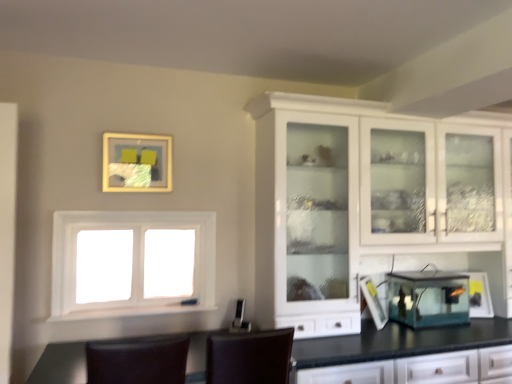
Question: Which direction should I rotate to look at transparent glass fish tank at center, which is counted as the 1th appliance, starting from the left?

Choices:
 (A) left
 (B) right

Answer: (B)

Question: Can you confirm if white glossy cabinet at upper right is taller than brown leather chair at lower center, the first chair from the left?

Choices:
 (A) yes
 (B) no

Answer: (A)

Question: Is white glossy cabinet at upper right to the right of brown leather chair at lower center, the 2th chair when ordered from right to left, from the viewer's perspective?

Choices:
 (A) yes
 (B) no

Answer: (A)

Question: From a real-world perspective, is white glossy cabinet at upper right positioned under brown leather chair at lower center, the 2th chair when ordered from right to left, based on gravity?

Choices:
 (A) no
 (B) yes

Answer: (A)

Question: Does white glossy cabinet at upper right have a larger size compared to brown leather chair at lower center, the 2th chair when ordered from right to left?

Choices:
 (A) yes
 (B) no

Answer: (A)

Question: Is white glossy cabinet at upper right not near brown leather chair at lower center, the 2th chair when ordered from right to left?

Choices:
 (A) yes
 (B) no

Answer: (A)

Question: From a real-world perspective, is white glossy cabinet at upper right on brown leather chair at lower center, the 2th chair when ordered from right to left?

Choices:
 (A) yes
 (B) no

Answer: (A)

Question: Can you confirm if transparent glass lantern at lower right, which ranks as the second appliance in left-to-right order, is thinner than transparent glass fish tank at center, which is counted as the 1th appliance, starting from the left?

Choices:
 (A) yes
 (B) no

Answer: (A)

Question: From a real-world perspective, is transparent glass lantern at lower right, the first appliance in the right-to-left sequence, positioned over transparent glass fish tank at center, which is the second appliance in right-to-left order, based on gravity?

Choices:
 (A) no
 (B) yes

Answer: (A)

Question: Is transparent glass lantern at lower right, the first appliance in the right-to-left sequence, taller than transparent glass fish tank at center, which is the second appliance in right-to-left order?

Choices:
 (A) yes
 (B) no

Answer: (B)

Question: Is transparent glass lantern at lower right, the first appliance in the right-to-left sequence, to the right of transparent glass fish tank at center, which is counted as the 1th appliance, starting from the left, from the viewer's perspective?

Choices:
 (A) yes
 (B) no

Answer: (A)

Question: From the image's perspective, is transparent glass lantern at lower right, which ranks as the second appliance in left-to-right order, below transparent glass fish tank at center, which is counted as the 1th appliance, starting from the left?

Choices:
 (A) no
 (B) yes

Answer: (B)

Question: Would you say transparent glass lantern at lower right, the first appliance in the right-to-left sequence, is outside transparent glass fish tank at center, which is counted as the 1th appliance, starting from the left?

Choices:
 (A) no
 (B) yes

Answer: (B)

Question: From a real-world perspective, does brown leather chair at lower center, the 2th chair when ordered from right to left, stand above transparent glass lantern at lower right, which ranks as the second appliance in left-to-right order?

Choices:
 (A) yes
 (B) no

Answer: (B)